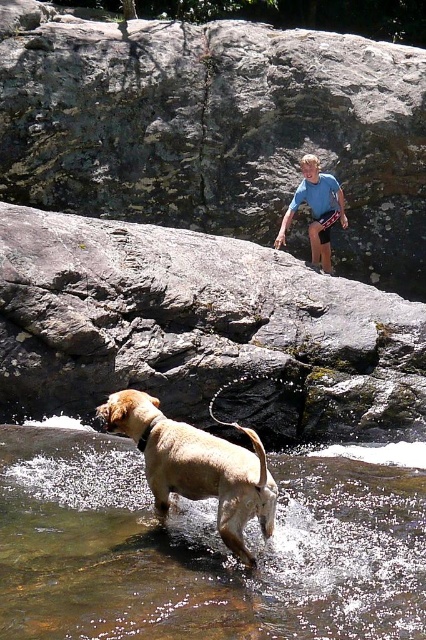
Consider the image. Can you confirm if gray rock at upper center is shorter than golden fur dog at lower center?

No, gray rock at upper center is not shorter than golden fur dog at lower center.

Does gray rock at upper center appear over golden fur dog at lower center?

Yes, gray rock at upper center is above golden fur dog at lower center.

Is point (299, 419) positioned in front of point (221, 476)?

No.

The image size is (426, 640). I want to click on gray rock at upper center, so 198,330.

Does brown smooth water at lower left appear on the right side of golden fur dog at lower center?

Indeed, brown smooth water at lower left is positioned on the right side of golden fur dog at lower center.

Which is behind, point (100, 554) or point (250, 554)?

The point (100, 554) is more distant.

Is point (287, 480) farther from viewer compared to point (98, 420)?

No, it is in front of (98, 420).

The height and width of the screenshot is (640, 426). I want to click on brown smooth water at lower left, so click(x=203, y=548).

Does gray rock at upper center appear over blue cotton shirt at upper center?

No.

Measure the distance from gray rock at upper center to blue cotton shirt at upper center.

gray rock at upper center is 6.89 feet away from blue cotton shirt at upper center.

Is point (103, 396) behind point (325, 179)?

No.

Locate an element on the screen. gray rock at upper center is located at coordinates (198, 330).